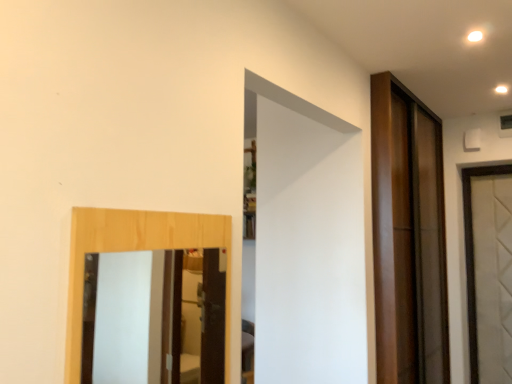
Question: Is the depth of shiny brown door at right greater than that of wooden-framed mirror at left?

Choices:
 (A) yes
 (B) no

Answer: (A)

Question: Considering the relative positions of shiny brown door at right and wooden-framed mirror at left in the image provided, is shiny brown door at right to the left of wooden-framed mirror at left from the viewer's perspective?

Choices:
 (A) yes
 (B) no

Answer: (B)

Question: Is wooden-framed mirror at left surrounded by shiny brown door at right?

Choices:
 (A) yes
 (B) no

Answer: (B)

Question: Is shiny brown door at right positioned with its back to wooden-framed mirror at left?

Choices:
 (A) yes
 (B) no

Answer: (B)

Question: Is shiny brown door at right at the right side of wooden-framed mirror at left?

Choices:
 (A) yes
 (B) no

Answer: (A)

Question: Does shiny brown door at right have a greater width compared to wooden-framed mirror at left?

Choices:
 (A) yes
 (B) no

Answer: (A)

Question: Is wooden-framed mirror at left next to shiny brown door at right?

Choices:
 (A) no
 (B) yes

Answer: (A)

Question: Is shiny brown door at right a part of wooden-framed mirror at left?

Choices:
 (A) yes
 (B) no

Answer: (B)

Question: Is wooden-framed mirror at left not within shiny brown door at right?

Choices:
 (A) yes
 (B) no

Answer: (A)

Question: Are wooden-framed mirror at left and shiny brown door at right located far from each other?

Choices:
 (A) no
 (B) yes

Answer: (B)

Question: Does wooden-framed mirror at left turn towards shiny brown door at right?

Choices:
 (A) no
 (B) yes

Answer: (A)

Question: From a real-world perspective, is wooden-framed mirror at left physically below shiny brown door at right?

Choices:
 (A) no
 (B) yes

Answer: (B)

Question: Is wooden-framed mirror at left bigger or smaller than shiny brown door at right?

Choices:
 (A) small
 (B) big

Answer: (A)